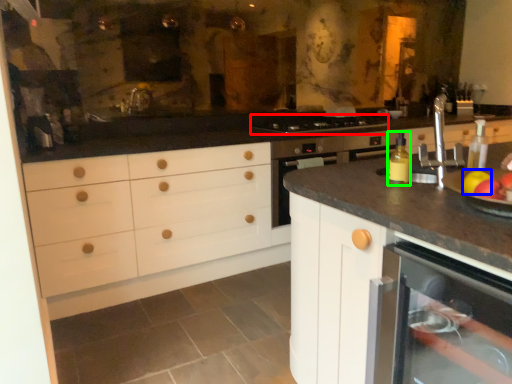
Question: Considering the real-world distances, which object is closest to gas stove (highlighted by a red box)? apple (highlighted by a blue box) or bottle (highlighted by a green box).

Choices:
 (A) apple
 (B) bottle

Answer: (B)